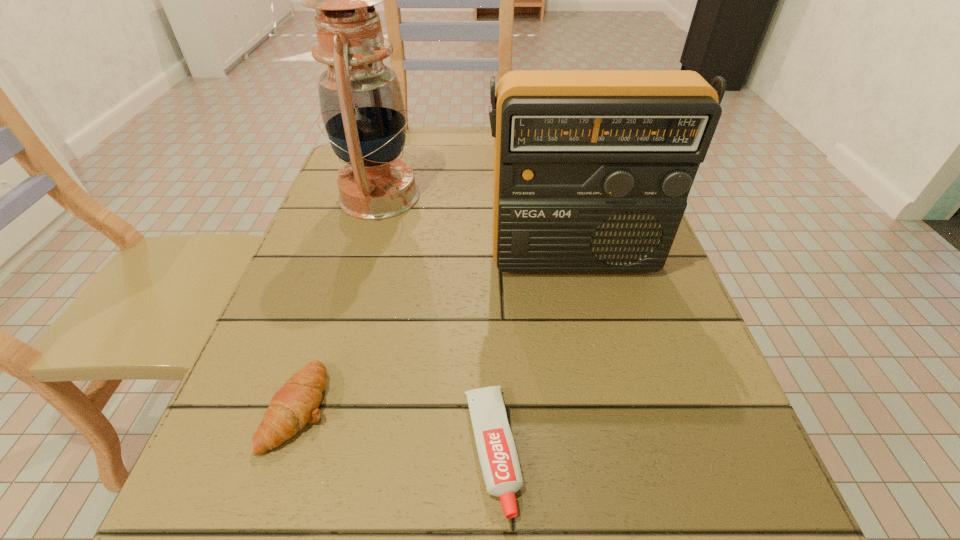
Image resolution: width=960 pixels, height=540 pixels. Find the location of `object that is positioned at the far edge`. object that is positioned at the far edge is located at coordinates (362, 107).

The height and width of the screenshot is (540, 960). I want to click on object that is at the near edge, so click(496, 449).

The width and height of the screenshot is (960, 540). I want to click on oil lamp that is at the left edge, so click(x=362, y=107).

Find the location of `crescent roll positioned at the left edge`. crescent roll positioned at the left edge is located at coordinates (296, 403).

Identify the location of object that is at the right edge. (592, 168).

Find the location of `object situated at the far left corner`. object situated at the far left corner is located at coordinates (362, 107).

This screenshot has height=540, width=960. What are the coordinates of `free region at the far edge of the desktop` in the screenshot? It's located at (478, 194).

Where is `free location at the near edge`? The height and width of the screenshot is (540, 960). free location at the near edge is located at coordinates (325, 499).

Identify the location of free region at the left edge of the desktop. The image size is (960, 540). (342, 234).

Where is `free location at the right edge of the desktop`? The width and height of the screenshot is (960, 540). free location at the right edge of the desktop is located at coordinates (710, 409).